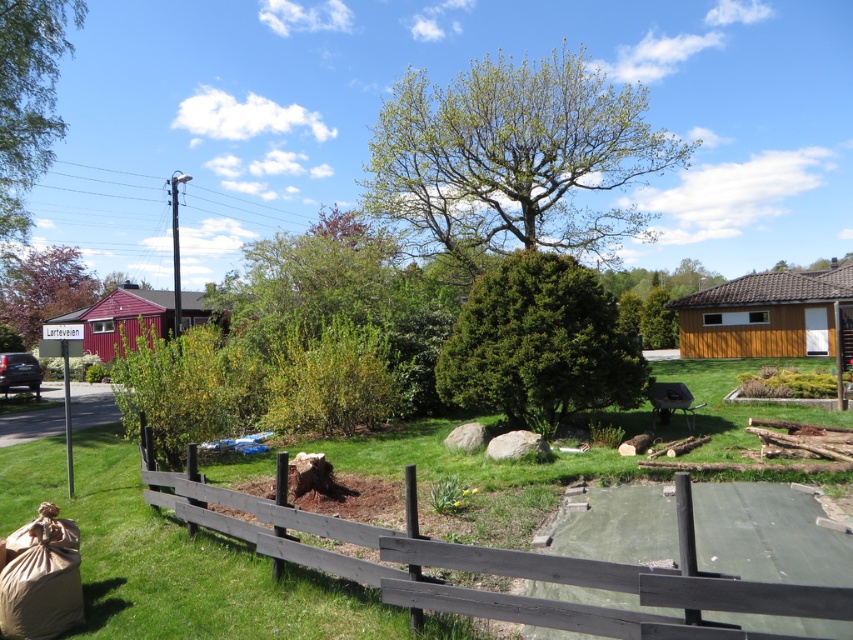
Question: Is brown wooden fence at center below green textured shrub at center?

Choices:
 (A) no
 (B) yes

Answer: (B)

Question: Can you confirm if green leafy tree at center is thinner than brown wooden fence at center?

Choices:
 (A) no
 (B) yes

Answer: (A)

Question: Can you confirm if brown wooden fence at center is thinner than green textured shrub at center?

Choices:
 (A) yes
 (B) no

Answer: (B)

Question: Estimate the real-world distances between objects in this image. Which object is farther from the green leafy tree at left?

Choices:
 (A) green grass at center
 (B) green textured shrub at center
 (C) green leafy tree at center

Answer: (A)

Question: Which of the following is the farthest from the observer?

Choices:
 (A) (10, 198)
 (B) (96, 472)
 (C) (32, 262)

Answer: (C)

Question: Which of the following is the farthest from the observer?

Choices:
 (A) green leafy tree at left
 (B) green leafy tree at center
 (C) green grass at center

Answer: (A)